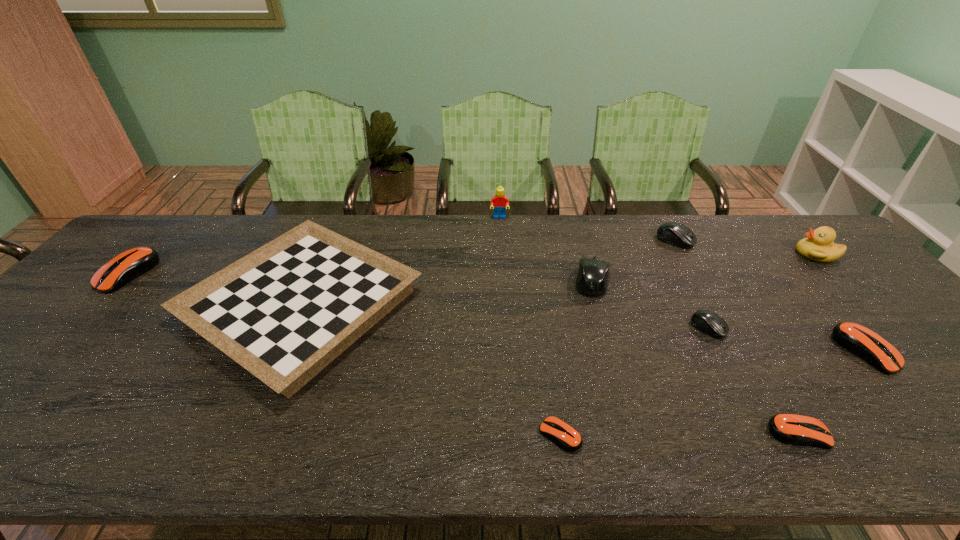
This screenshot has height=540, width=960. In order to click on Lego present at the far edge in this screenshot , I will do coord(500,202).

Where is `duckling positioned at the far edge`? duckling positioned at the far edge is located at coordinates (818, 246).

You are a GUI agent. You are given a task and a screenshot of the screen. Output one action in this format:
    pyautogui.click(x=<x>, y=<y>)
    Task: Click on the checkerboard located at the far edge
    The width and height of the screenshot is (960, 540).
    Given the screenshot: What is the action you would take?
    pyautogui.click(x=285, y=311)

Find the location of a particular element. This screenshot has height=540, width=960. object positioned at the left edge is located at coordinates (125, 267).

Identify the location of duckling situated at the right edge. The height and width of the screenshot is (540, 960). (818, 246).

Image resolution: width=960 pixels, height=540 pixels. I want to click on computer mouse that is at the right edge, so click(x=859, y=340).

Locate an element on the screen. Image resolution: width=960 pixels, height=540 pixels. object that is at the far left corner is located at coordinates (125, 267).

The width and height of the screenshot is (960, 540). I want to click on object that is at the far right corner, so click(818, 246).

The width and height of the screenshot is (960, 540). In order to click on vacant space at the far edge in this screenshot , I will do `click(591, 218)`.

In the image, there is a desktop. What are the coordinates of `vacant region at the near edge` in the screenshot? It's located at (726, 423).